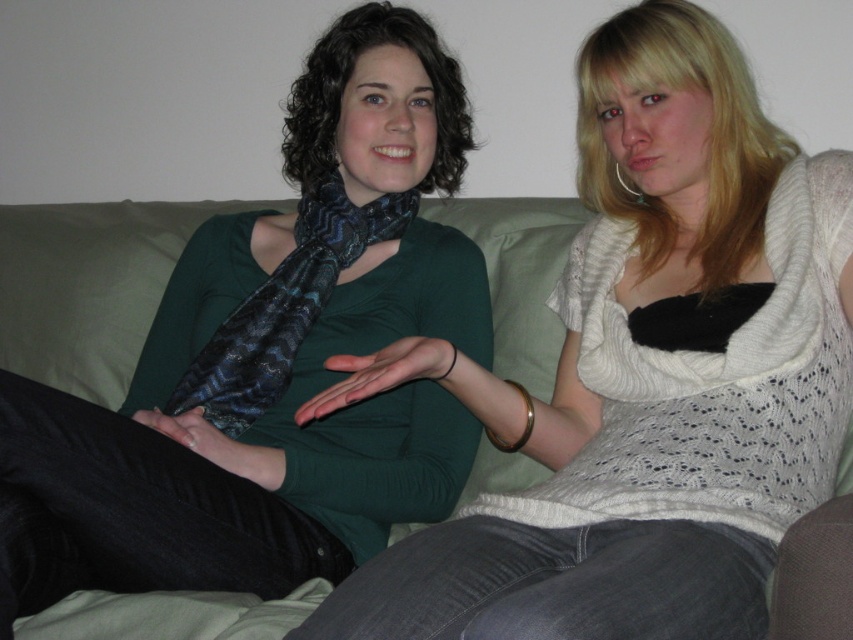
You are arranging a photo shoot and need to place two scarves on a model. The scene has a matte black scarf at center and a shiny blue silk scarf at center. Which scarf is located to the right of the other?

The matte black scarf at center is positioned on the right side of the shiny blue silk scarf at center.

You are designing a living room and want to place a floor lamp next to the green fabric couch at center. Considering the height of the couch and the shiny blue silk scarf at center, which object should the lamp be taller than to ensure it doesn

The green fabric couch at center has a lesser height compared to shiny blue silk scarf at center. Therefore, the floor lamp should be taller than the green fabric couch at center to ensure it is also taller than the shiny blue silk scarf at center.